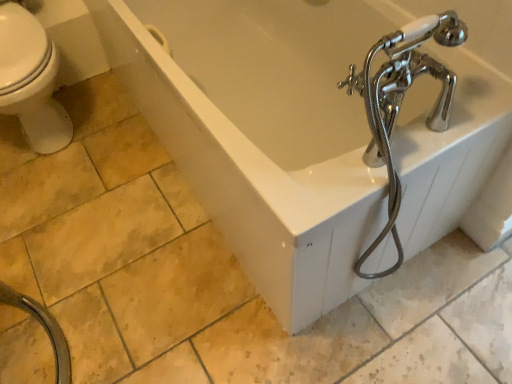
This screenshot has width=512, height=384. What are the coordinates of `free space to the right of black rubber garden hose at lower left` in the screenshot? It's located at (141, 321).